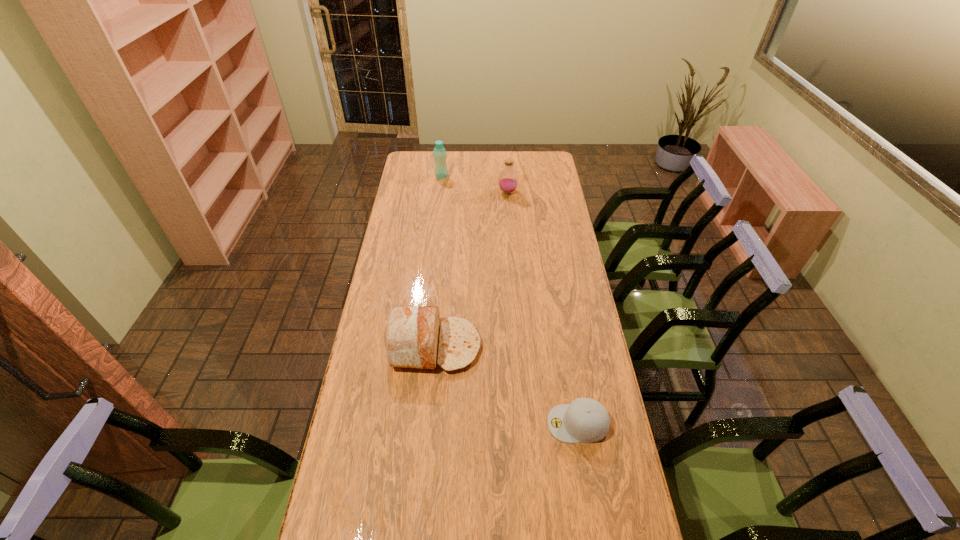
What are the coordinates of `free space located at the sliced end of the third farthest object` in the screenshot? It's located at (506, 346).

Find the location of a particular element. The image size is (960, 540). vacant position located 0.270m on the front-facing side of the nearest object is located at coordinates (459, 423).

This screenshot has height=540, width=960. Find the location of `vacant area located 0.330m on the front-facing side of the nearest object`. vacant area located 0.330m on the front-facing side of the nearest object is located at coordinates (440, 423).

The height and width of the screenshot is (540, 960). In order to click on vacant space located 0.240m on the front-facing side of the nearest object in this screenshot , I will do `click(469, 423)`.

You are a GUI agent. You are given a task and a screenshot of the screen. Output one action in this format:
    pyautogui.click(x=<x>, y=<y>)
    Task: Click on the object that is at the far edge
    
    Given the screenshot: What is the action you would take?
    pyautogui.click(x=439, y=152)

You are a GUI agent. You are given a task and a screenshot of the screen. Output one action in this format:
    pyautogui.click(x=<x>, y=<y>)
    Task: Click on the object situated at the left edge
    This screenshot has width=960, height=540.
    Given the screenshot: What is the action you would take?
    pyautogui.click(x=411, y=336)

The width and height of the screenshot is (960, 540). What are the coordinates of `object at the right edge` in the screenshot? It's located at (585, 420).

What are the coordinates of `vacant space at the far edge of the desktop` in the screenshot? It's located at (462, 161).

The height and width of the screenshot is (540, 960). What are the coordinates of `vacant area at the left edge of the desktop` in the screenshot? It's located at (392, 302).

In the image, there is a desktop. At what (x,y) coordinates should I click in order to perform the action: click on free space at the right edge. Please return your answer as a coordinate pair (x, y). Image resolution: width=960 pixels, height=540 pixels. Looking at the image, I should click on (582, 377).